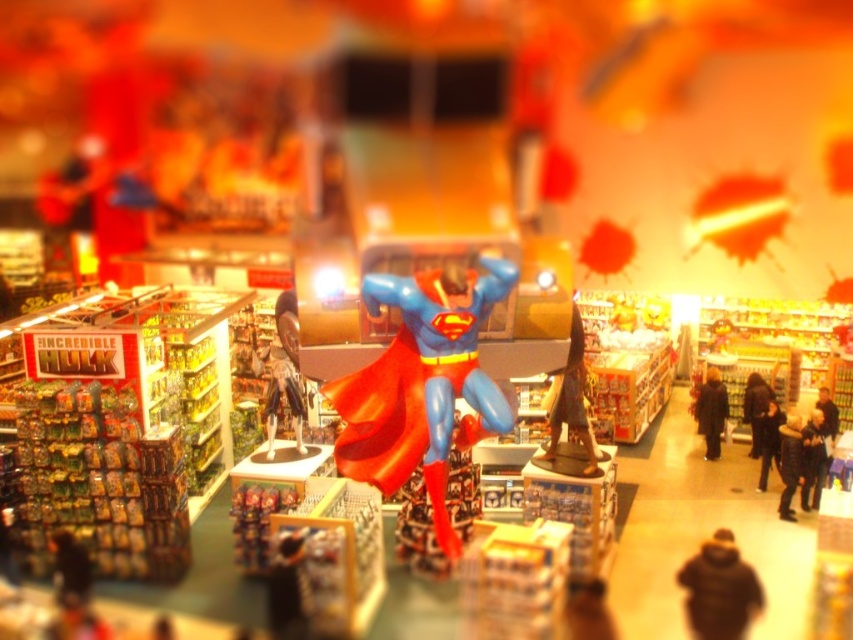
You are a customer in the toy store and want to find the blue glossy superman figure at center. According to the store layout, where should you look?

The blue glossy superman figure at center is located at the 2D coordinates point (422, 384) in the store layout.

You are a customer in the toy store and want to place both the bronze statue at center and the black wool coat at center on a shelf. The shelf has a width of 1.2 meters. Can both items fit side by side without overlapping?

The bronze statue at center might be wider than black wool coat at center. Since the shelf is 1.2 meters wide, it is uncertain if both items can fit side by side without overlapping. The width of the bronze statue at center compared to the black wool coat at center determines the possibility, but the exact dimensions aren